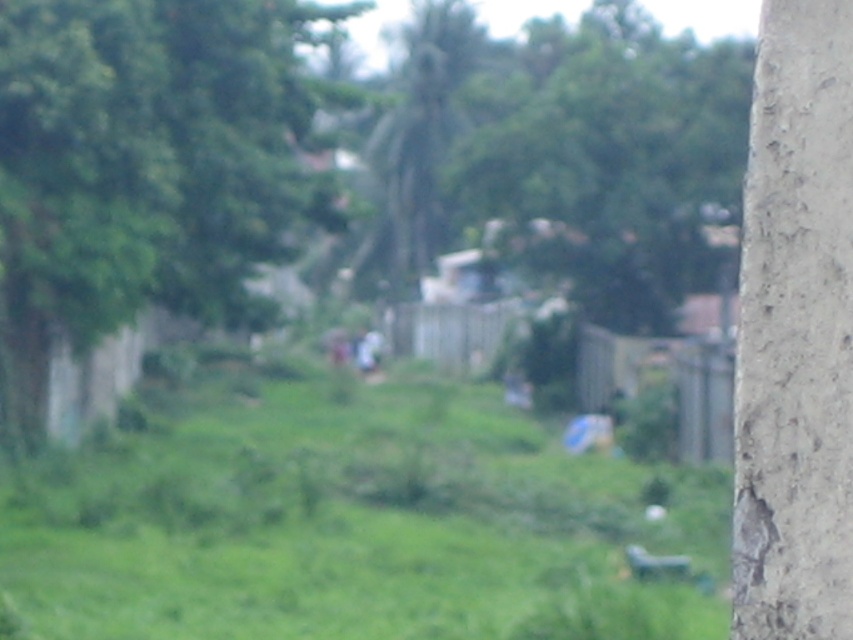
You are a hiker trying to navigate through the grassy field in the scene. You notice two green leafy trees ahead. Which tree, the green leafy tree at center or the green leafy tree at upper center, would you choose as a landmark if you want to follow a path that leads towards the smaller tree?

The green leafy tree at center is smaller in size compared to the green leafy tree at upper center. So, if you want to follow a path leading towards the smaller tree, you should use the green leafy tree at center as your landmark.